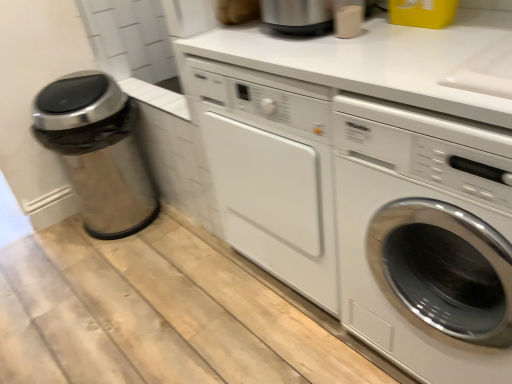
Question: Does white glossy washing machine at center right appear on the left side of stainless steel trash can at left?

Choices:
 (A) yes
 (B) no

Answer: (B)

Question: Is white glossy washing machine at center right not near stainless steel trash can at left?

Choices:
 (A) yes
 (B) no

Answer: (A)

Question: Does white glossy washing machine at center right have a lesser height compared to stainless steel trash can at left?

Choices:
 (A) no
 (B) yes

Answer: (A)

Question: Is white glossy washing machine at center right turned away from stainless steel trash can at left?

Choices:
 (A) yes
 (B) no

Answer: (B)

Question: From the image's perspective, is white glossy washing machine at center right on stainless steel trash can at left?

Choices:
 (A) no
 (B) yes

Answer: (A)

Question: Considering the relative positions of white glossy washing machine at center right and stainless steel trash can at left in the image provided, is white glossy washing machine at center right in front of stainless steel trash can at left?

Choices:
 (A) no
 (B) yes

Answer: (B)

Question: From the image's perspective, is stainless steel trash can at left on white glossy washing machine at center right?

Choices:
 (A) no
 (B) yes

Answer: (B)

Question: Can you confirm if stainless steel trash can at left is taller than white glossy washing machine at center right?

Choices:
 (A) no
 (B) yes

Answer: (A)

Question: From a real-world perspective, does stainless steel trash can at left sit lower than white glossy washing machine at center right?

Choices:
 (A) no
 (B) yes

Answer: (B)

Question: Is stainless steel trash can at left wider than white glossy washing machine at center right?

Choices:
 (A) no
 (B) yes

Answer: (A)

Question: Is stainless steel trash can at left facing towards white glossy washing machine at center right?

Choices:
 (A) no
 (B) yes

Answer: (B)

Question: Is stainless steel trash can at left directly adjacent to white glossy washing machine at center right?

Choices:
 (A) yes
 (B) no

Answer: (B)

Question: Is point (66, 168) positioned closer to the camera than point (483, 344)?

Choices:
 (A) farther
 (B) closer

Answer: (A)